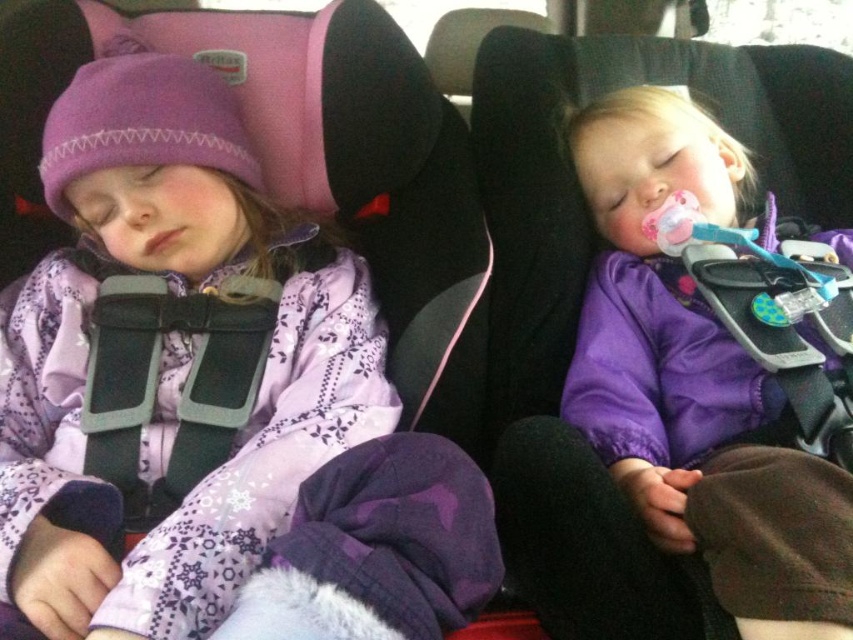
Does purple satin jacket at left appear over purple satin baby at center?

Incorrect, purple satin jacket at left is not positioned above purple satin baby at center.

Between purple satin jacket at left and purple satin baby at center, which one appears on the right side from the viewer's perspective?

From the viewer's perspective, purple satin baby at center appears more on the right side.

Which is behind, point (113, 220) or point (599, 152)?

The point (599, 152) is behind.

At what (x,y) coordinates should I click in order to perform the action: click on purple satin jacket at left. Please return your answer as a coordinate pair (x, y). The width and height of the screenshot is (853, 640). Looking at the image, I should click on (212, 403).